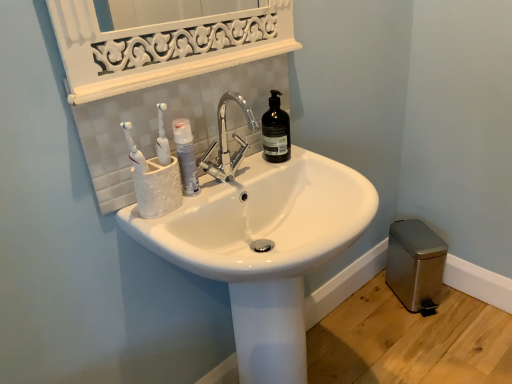
This screenshot has height=384, width=512. What do you see at coordinates (276, 131) in the screenshot?
I see `black matte bottle at upper center` at bounding box center [276, 131].

The height and width of the screenshot is (384, 512). In order to click on white glossy mouthwash at center in this screenshot , I will do `click(186, 156)`.

This screenshot has height=384, width=512. What do you see at coordinates (186, 156) in the screenshot?
I see `white glossy mouthwash at center` at bounding box center [186, 156].

The image size is (512, 384). I want to click on black matte bottle at upper center, so click(x=276, y=131).

Is white glossy mouthwash at center facing towards black matte bottle at upper center?

No, white glossy mouthwash at center does not turn towards black matte bottle at upper center.

Considering the relative sizes of white glossy mouthwash at center and black matte bottle at upper center in the image provided, is white glossy mouthwash at center wider than black matte bottle at upper center?

No.

Does point (193, 170) lie in front of point (265, 137)?

That is True.

This screenshot has width=512, height=384. Identify the location of mouthwash in front of the black matte bottle at upper center. (186, 156).

Measure the distance from white glossy sink at center to metallic gray trash can at lower right.

white glossy sink at center and metallic gray trash can at lower right are 32.76 inches apart.

Could you tell me if white glossy sink at center is facing metallic gray trash can at lower right?

No, white glossy sink at center is not facing towards metallic gray trash can at lower right.

From a real-world perspective, is white glossy sink at center over metallic gray trash can at lower right?

Correct, in the physical world, white glossy sink at center is higher than metallic gray trash can at lower right.

Is point (178, 256) behind point (410, 236)?

No, it is not.

Between black matte bottle at upper center and metallic gray trash can at lower right, which one has less height?

With less height is black matte bottle at upper center.

How different are the orientations of black matte bottle at upper center and metallic gray trash can at lower right in degrees?

The angular difference between black matte bottle at upper center and metallic gray trash can at lower right is 24.9 degrees.

Is black matte bottle at upper center not near metallic gray trash can at lower right?

No, black matte bottle at upper center is in close proximity to metallic gray trash can at lower right.

Is black matte bottle at upper center situated inside metallic gray trash can at lower right or outside?

black matte bottle at upper center is located beyond the bounds of metallic gray trash can at lower right.

Is black matte bottle at upper center bigger than white glossy mouthwash at center?

Yes.

Is white glossy mouthwash at center at the back of black matte bottle at upper center?

No, white glossy mouthwash at center is not at the back of black matte bottle at upper center.

Consider the image. Is black matte bottle at upper center touching white glossy mouthwash at center?

black matte bottle at upper center and white glossy mouthwash at center are clearly separated.

How different are the orientations of black matte bottle at upper center and white glossy mouthwash at center in degrees?

The facing directions of black matte bottle at upper center and white glossy mouthwash at center are 5.92 degrees apart.

Looking at this image, from the image's perspective, which is below, metallic gray trash can at lower right or white glossy sink at center?

white glossy sink at center, from the image's perspective.

Considering the positions of objects metallic gray trash can at lower right and white glossy sink at center in the image provided, who is in front, metallic gray trash can at lower right or white glossy sink at center?

Positioned in front is white glossy sink at center.

From a real-world perspective, is metallic gray trash can at lower right physically located above or below white glossy sink at center?

In terms of real-world spatial position, metallic gray trash can at lower right is below white glossy sink at center.

Based on the photo, can you confirm if metallic gray trash can at lower right is taller than white glossy sink at center?

No.

From a real-world perspective, is black matte bottle at upper center physically below white glossy sink at center?

Actually, black matte bottle at upper center is physically above white glossy sink at center in the real world.

Locate an element on the screen. sink below the black matte bottle at upper center (from a real-world perspective) is located at coordinates (264, 248).

In the image, is black matte bottle at upper center on the left side or the right side of white glossy sink at center?

Clearly, black matte bottle at upper center is on the left of white glossy sink at center in the image.

Is black matte bottle at upper center spatially inside white glossy sink at center, or outside of it?

black matte bottle at upper center is outside white glossy sink at center.

Which is more to the right, white glossy mouthwash at center or metallic gray trash can at lower right?

metallic gray trash can at lower right.

Considering the points (192, 181) and (414, 281), which point is behind, point (192, 181) or point (414, 281)?

The point (414, 281) is more distant.

Between white glossy mouthwash at center and metallic gray trash can at lower right, which one has less height?

white glossy mouthwash at center.

Image resolution: width=512 pixels, height=384 pixels. In order to click on mouthwash in front of the black matte bottle at upper center in this screenshot , I will do `click(186, 156)`.

I want to click on sink on the left of metallic gray trash can at lower right, so click(x=264, y=248).

Looking at the image, which one is located closer to white glossy sink at center, black matte bottle at upper center or metallic gray trash can at lower right?

Based on the image, black matte bottle at upper center appears to be nearer to white glossy sink at center.

Based on their spatial positions, is black matte bottle at upper center or white glossy sink at center closer to white glossy mouthwash at center?

black matte bottle at upper center lies closer to white glossy mouthwash at center than the other object.

Based on their spatial positions, is black matte bottle at upper center or white glossy mouthwash at center closer to white glossy sink at center?

Based on the image, white glossy mouthwash at center appears to be nearer to white glossy sink at center.

Estimate the real-world distances between objects in this image. Which object is closer to metallic gray trash can at lower right, white glossy mouthwash at center or white glossy sink at center?

The object closer to metallic gray trash can at lower right is white glossy sink at center.

Looking at the image, which one is located further to metallic gray trash can at lower right, black matte bottle at upper center or white glossy mouthwash at center?

white glossy mouthwash at center is further to metallic gray trash can at lower right.

Considering their positions, is metallic gray trash can at lower right positioned closer to white glossy mouthwash at center than black matte bottle at upper center?

black matte bottle at upper center.

Which object lies nearer to the anchor point white glossy sink at center, metallic gray trash can at lower right or black matte bottle at upper center?

black matte bottle at upper center.

Considering their positions, is white glossy mouthwash at center positioned further to white glossy sink at center than metallic gray trash can at lower right?

metallic gray trash can at lower right is positioned further to the anchor white glossy sink at center.

Identify the location of bottle situated between white glossy mouthwash at center and metallic gray trash can at lower right from left to right. This screenshot has height=384, width=512. (276, 131).

You are a GUI agent. You are given a task and a screenshot of the screen. Output one action in this format:
    pyautogui.click(x=<x>, y=<y>)
    Task: Click on the mouthwash between white glossy sink at center and metallic gray trash can at lower right along the z-axis
    The height and width of the screenshot is (384, 512).
    Given the screenshot: What is the action you would take?
    coord(186,156)

Where is `mouthwash between black matte bottle at upper center and white glossy sink at center in the up-down direction`? Image resolution: width=512 pixels, height=384 pixels. mouthwash between black matte bottle at upper center and white glossy sink at center in the up-down direction is located at coordinates click(x=186, y=156).

At what (x,y) coordinates should I click in order to perform the action: click on bottle positioned between white glossy sink at center and metallic gray trash can at lower right from near to far. Please return your answer as a coordinate pair (x, y). The height and width of the screenshot is (384, 512). Looking at the image, I should click on (276, 131).